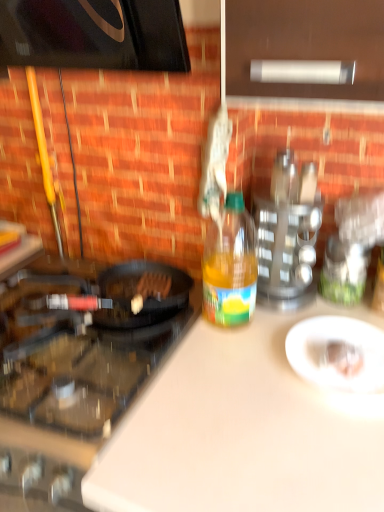
You are a GUI agent. You are given a task and a screenshot of the screen. Output one action in this format:
    pyautogui.click(x=<x>, y=<y>)
    Task: Click on the blank space situated above white matte cutting board at center (from a real-world perspective)
    The height and width of the screenshot is (512, 384).
    Given the screenshot: What is the action you would take?
    pyautogui.click(x=291, y=366)